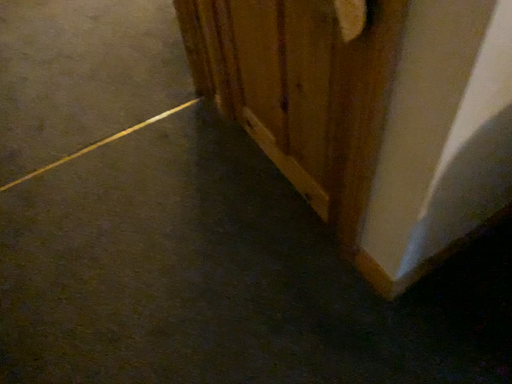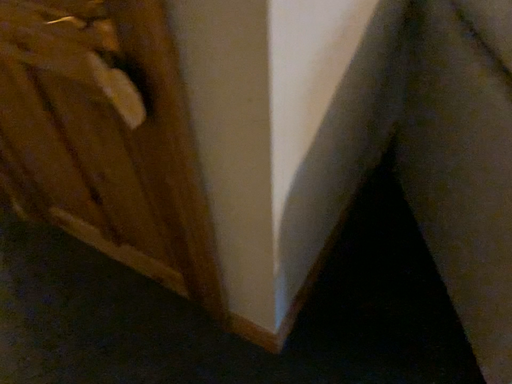
Question: How did the camera likely rotate when shooting the video?

Choices:
 (A) rotated downward
 (B) rotated upward

Answer: (B)